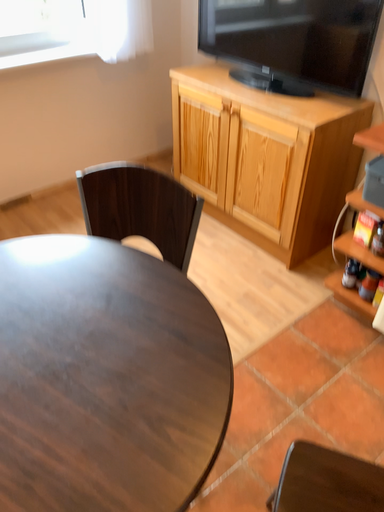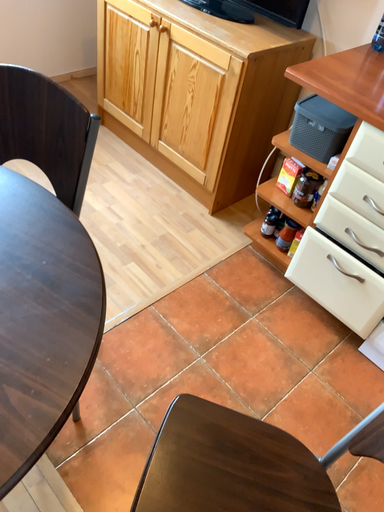
Question: Which way did the camera rotate in the video?

Choices:
 (A) rotated left
 (B) rotated right

Answer: (B)